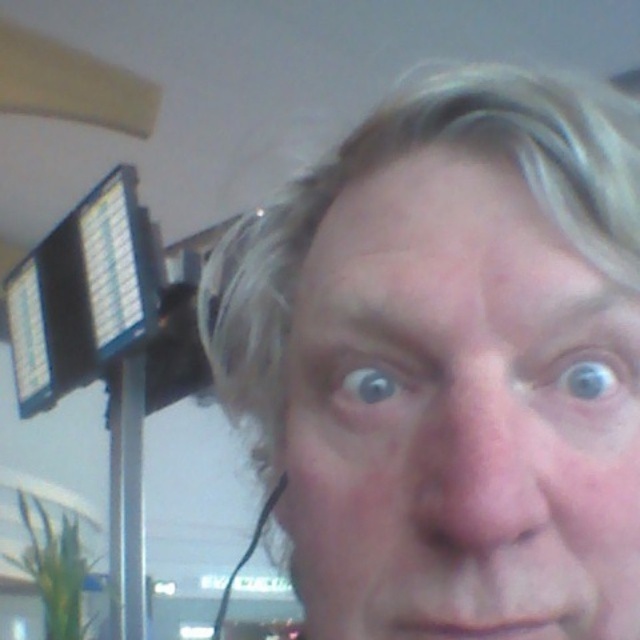
Which is in front, point (577, 97) or point (54, 337)?

Point (577, 97)

Where is `gray matte hair at center`? The width and height of the screenshot is (640, 640). gray matte hair at center is located at coordinates (449, 362).